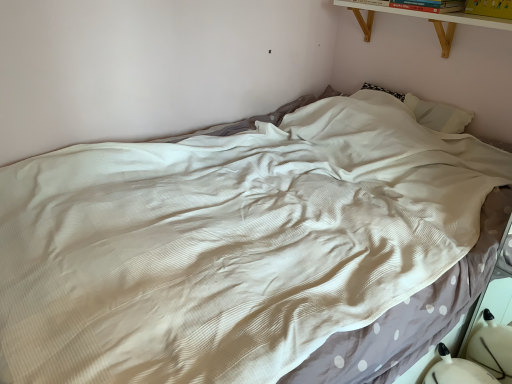
Identify the location of yellow paper at upper right, the 1th book from the right. (490, 8).

Does yellow paper at upper right, which is counted as the 2th book, starting from the left, appear on the right side of hardcover book at upper right, the 2th book positioned from the right?

Yes, yellow paper at upper right, which is counted as the 2th book, starting from the left, is to the right of hardcover book at upper right, the 2th book positioned from the right.

Is yellow paper at upper right, which is counted as the 2th book, starting from the left, completely or partially outside of hardcover book at upper right, the 2th book positioned from the right?

Yes.

From a real-world perspective, is yellow paper at upper right, which is counted as the 2th book, starting from the left, positioned above or below hardcover book at upper right, arranged as the 1th book when viewed from the left?

yellow paper at upper right, which is counted as the 2th book, starting from the left, is above hardcover book at upper right, arranged as the 1th book when viewed from the left.

Is point (474, 3) farther from viewer compared to point (408, 8)?

No, it is not.

From a real-world perspective, is white fabric swivel chair at lower right physically located above or below white wood shelf at upper right?

From a real-world perspective, white fabric swivel chair at lower right is physically below white wood shelf at upper right.

Is white fabric swivel chair at lower right positioned behind white wood shelf at upper right?

No, it is in front of white wood shelf at upper right.

Does point (428, 374) appear closer or farther from the camera than point (484, 23)?

Point (428, 374).

Which object is wider, white fabric swivel chair at lower right or white wood shelf at upper right?

white fabric swivel chair at lower right is wider.

Is white fabric swivel chair at lower right aimed at yellow paper at upper right, which is counted as the 2th book, starting from the left?

No, white fabric swivel chair at lower right is not aimed at yellow paper at upper right, which is counted as the 2th book, starting from the left.

From the image's perspective, which is below, white fabric swivel chair at lower right or yellow paper at upper right, the 1th book from the right?

white fabric swivel chair at lower right is shown below in the image.

Is white fabric swivel chair at lower right at the right side of yellow paper at upper right, the 1th book from the right?

No.

Is point (478, 355) less distant than point (490, 7)?

Yes, point (478, 355) is in front of point (490, 7).

Considering the points (362, 28) and (396, 6), which point is behind, point (362, 28) or point (396, 6)?

Point (362, 28)

Can you confirm if white wood shelf at upper right is shorter than hardcover book at upper right, arranged as the 1th book when viewed from the left?

Incorrect, the height of white wood shelf at upper right does not fall short of that of hardcover book at upper right, arranged as the 1th book when viewed from the left.

Is white wood shelf at upper right far away from hardcover book at upper right, the 2th book positioned from the right?

They are positioned close to each other.

Does white wood shelf at upper right contain hardcover book at upper right, arranged as the 1th book when viewed from the left?

No, hardcover book at upper right, arranged as the 1th book when viewed from the left, is not inside white wood shelf at upper right.

Who is taller, yellow paper at upper right, the 1th book from the right, or white fabric swivel chair at lower right?

white fabric swivel chair at lower right.

Are yellow paper at upper right, which is counted as the 2th book, starting from the left, and white fabric swivel chair at lower right located far from each other?

Yes, yellow paper at upper right, which is counted as the 2th book, starting from the left, and white fabric swivel chair at lower right are quite far apart.

Is yellow paper at upper right, which is counted as the 2th book, starting from the left, situated inside white fabric swivel chair at lower right or outside?

yellow paper at upper right, which is counted as the 2th book, starting from the left, exists outside the volume of white fabric swivel chair at lower right.

Considering the positions of point (510, 7) and point (497, 364), is point (510, 7) closer or farther from the camera than point (497, 364)?

Point (510, 7) is positioned farther from the camera compared to point (497, 364).

How different are the orientations of hardcover book at upper right, arranged as the 1th book when viewed from the left, and white wood shelf at upper right in degrees?

The angular difference between hardcover book at upper right, arranged as the 1th book when viewed from the left, and white wood shelf at upper right is 0.551 degrees.

From the image's perspective, who appears lower, hardcover book at upper right, the 2th book positioned from the right, or white wood shelf at upper right?

white wood shelf at upper right, from the image's perspective.

Consider the image. Is hardcover book at upper right, the 2th book positioned from the right, touching white wood shelf at upper right?

They are not placed beside each other.

Is hardcover book at upper right, arranged as the 1th book when viewed from the left, facing away from white wood shelf at upper right?

No, hardcover book at upper right, arranged as the 1th book when viewed from the left, is not facing away from white wood shelf at upper right.

Which of these two, white fabric swivel chair at lower right or hardcover book at upper right, arranged as the 1th book when viewed from the left, is bigger?

Bigger between the two is white fabric swivel chair at lower right.

At what (x,y) coordinates should I click in order to perform the action: click on swivel chair in front of the hardcover book at upper right, the 2th book positioned from the right. Please return your answer as a coordinate pair (x, y). This screenshot has height=384, width=512. Looking at the image, I should click on (477, 358).

Based on the photo, is white fabric swivel chair at lower right wider or thinner than hardcover book at upper right, the 2th book positioned from the right?

In the image, white fabric swivel chair at lower right appears to be wider than hardcover book at upper right, the 2th book positioned from the right.

Where is `book below the hardcover book at upper right, arranged as the 1th book when viewed from the left (from the image's perspective)`? The height and width of the screenshot is (384, 512). book below the hardcover book at upper right, arranged as the 1th book when viewed from the left (from the image's perspective) is located at coordinates (490, 8).

Locate an element on the screen. The height and width of the screenshot is (384, 512). shelf above the white fabric swivel chair at lower right (from a real-world perspective) is located at coordinates (425, 18).

Estimate the real-world distances between objects in this image. Which object is closer to white fabric swivel chair at lower right, hardcover book at upper right, the 2th book positioned from the right, or white wood shelf at upper right?

white wood shelf at upper right.

When comparing their distances from white wood shelf at upper right, does white fabric swivel chair at lower right or yellow paper at upper right, the 1th book from the right, seem further?

The object further to white wood shelf at upper right is white fabric swivel chair at lower right.

Considering their positions, is white wood shelf at upper right positioned closer to yellow paper at upper right, the 1th book from the right, than white fabric swivel chair at lower right?

Based on the image, white wood shelf at upper right appears to be nearer to yellow paper at upper right, the 1th book from the right.

Considering their positions, is white fabric swivel chair at lower right positioned further to hardcover book at upper right, arranged as the 1th book when viewed from the left, than white wood shelf at upper right?

The object further to hardcover book at upper right, arranged as the 1th book when viewed from the left, is white fabric swivel chair at lower right.

Based on the photo, from the image, which object appears to be nearer to white fabric swivel chair at lower right, yellow paper at upper right, the 1th book from the right, or hardcover book at upper right, the 2th book positioned from the right?

yellow paper at upper right, the 1th book from the right.

From the image, which object appears to be nearer to hardcover book at upper right, arranged as the 1th book when viewed from the left, white wood shelf at upper right or yellow paper at upper right, the 1th book from the right?

The object closer to hardcover book at upper right, arranged as the 1th book when viewed from the left, is white wood shelf at upper right.

Based on their spatial positions, is white wood shelf at upper right or hardcover book at upper right, the 2th book positioned from the right, closer to white fabric swivel chair at lower right?

The object closer to white fabric swivel chair at lower right is white wood shelf at upper right.

Considering their positions, is white fabric swivel chair at lower right positioned further to hardcover book at upper right, the 2th book positioned from the right, than yellow paper at upper right, the 1th book from the right?

white fabric swivel chair at lower right is positioned further to the anchor hardcover book at upper right, the 2th book positioned from the right.

Identify the location of book between hardcover book at upper right, arranged as the 1th book when viewed from the left, and white fabric swivel chair at lower right from top to bottom. The image size is (512, 384). (490, 8).

This screenshot has height=384, width=512. In order to click on book situated between white wood shelf at upper right and yellow paper at upper right, the 1th book from the right, from left to right in this screenshot , I will do `click(429, 5)`.

At what (x,y) coordinates should I click in order to perform the action: click on shelf between yellow paper at upper right, the 1th book from the right, and white fabric swivel chair at lower right in the up-down direction. Please return your answer as a coordinate pair (x, y). Image resolution: width=512 pixels, height=384 pixels. Looking at the image, I should click on (425, 18).

You are a GUI agent. You are given a task and a screenshot of the screen. Output one action in this format:
    pyautogui.click(x=<x>, y=<y>)
    Task: Click on the shelf between hardcover book at upper right, the 2th book positioned from the right, and white fabric swivel chair at lower right in the up-down direction
    
    Given the screenshot: What is the action you would take?
    [425, 18]